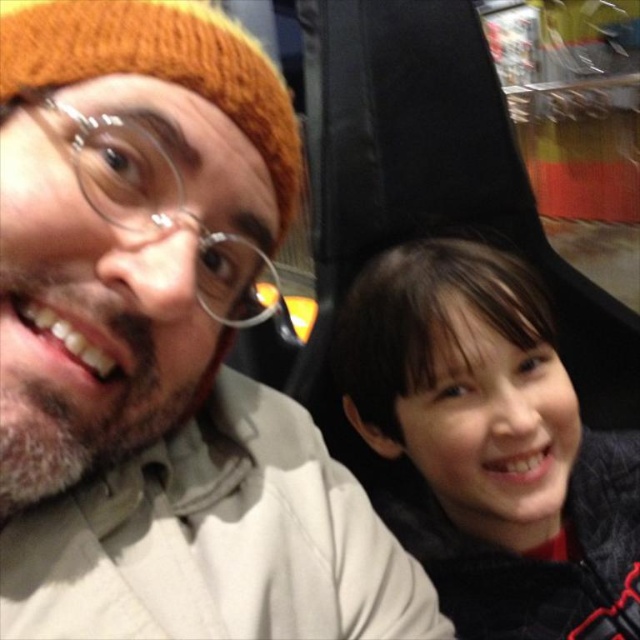
You are standing in a public space and see two people sitting close together. The adult on the left is wearing a mustard yellow knit cap, and the child on the right has a dark jacket with red accents. There is a knitted wool hat at upper left located at point (161,348). If you want to pick up the knitted wool hat at upper left, which person should you approach?

The knitted wool hat at upper left is located at point (161,348), which is closer to the adult on the left wearing the mustard yellow knit cap. Therefore, you should approach the adult on the left.